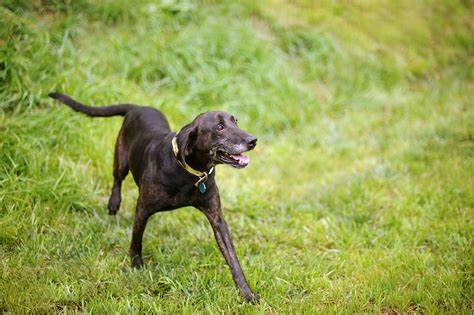
Identify the location of chest. (183, 179).